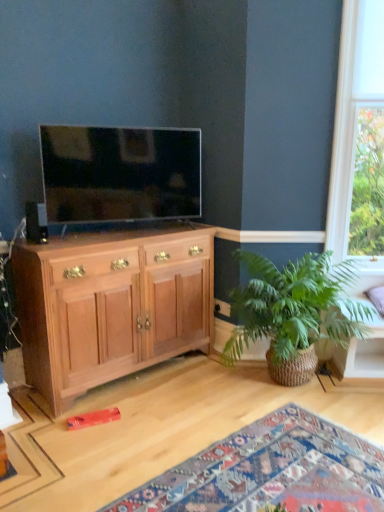
Question: Does matte black speaker at left turn towards matte black tv at upper left?

Choices:
 (A) no
 (B) yes

Answer: (A)

Question: Is matte black tv at upper left a part of matte black speaker at left?

Choices:
 (A) yes
 (B) no

Answer: (B)

Question: From a real-world perspective, is matte black speaker at left over matte black tv at upper left?

Choices:
 (A) yes
 (B) no

Answer: (B)

Question: Can you confirm if matte black speaker at left is smaller than matte black tv at upper left?

Choices:
 (A) no
 (B) yes

Answer: (B)

Question: Can you confirm if matte black speaker at left is thinner than matte black tv at upper left?

Choices:
 (A) yes
 (B) no

Answer: (A)

Question: Is matte black speaker at left positioned before matte black tv at upper left?

Choices:
 (A) yes
 (B) no

Answer: (A)

Question: Is matte black tv at upper left looking in the opposite direction of wooden toy at lower left?

Choices:
 (A) yes
 (B) no

Answer: (B)

Question: Is matte black tv at upper left not within wooden toy at lower left?

Choices:
 (A) yes
 (B) no

Answer: (A)

Question: Is wooden toy at lower left completely or partially inside matte black tv at upper left?

Choices:
 (A) yes
 (B) no

Answer: (B)

Question: Does matte black tv at upper left have a greater width compared to wooden toy at lower left?

Choices:
 (A) no
 (B) yes

Answer: (A)

Question: From a real-world perspective, does matte black tv at upper left stand above wooden toy at lower left?

Choices:
 (A) no
 (B) yes

Answer: (B)

Question: Is matte black tv at upper left taller than wooden toy at lower left?

Choices:
 (A) no
 (B) yes

Answer: (B)

Question: Is matte black tv at upper left further to camera compared to wooden cabinet at left?

Choices:
 (A) yes
 (B) no

Answer: (A)